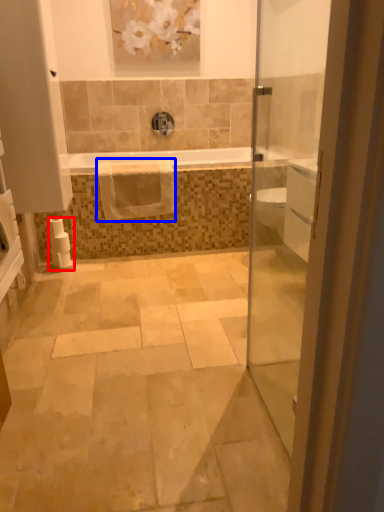
Question: Which object is closer to the camera taking this photo, toilet paper (highlighted by a red box) or hand towel (highlighted by a blue box)?

Choices:
 (A) toilet paper
 (B) hand towel

Answer: (A)